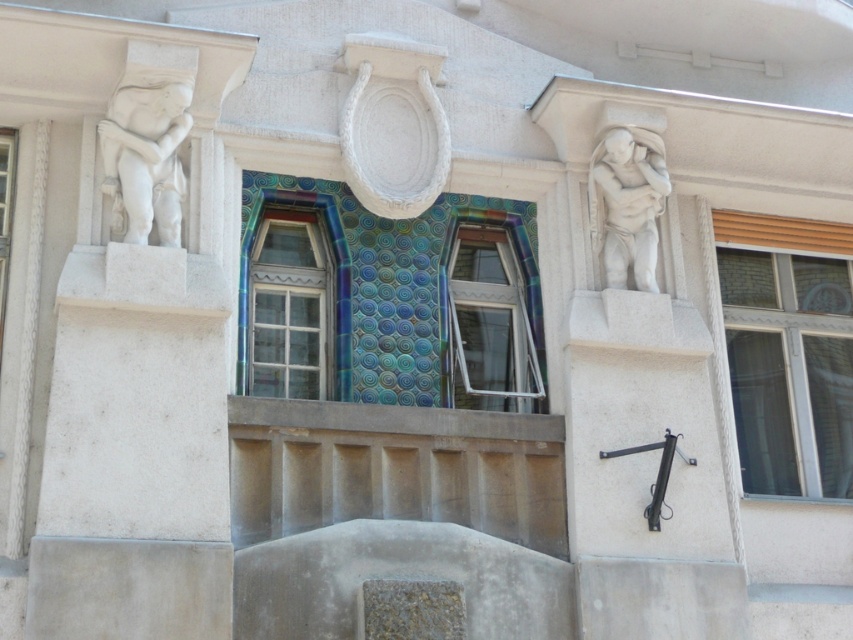
Question: Which point is farther to the camera?

Choices:
 (A) (12, 189)
 (B) (490, 323)
 (C) (753, 291)
 (D) (651, 220)

Answer: (C)

Question: Does white stone sculpture at right appear on the left side of multicolored mosaic tile at center?

Choices:
 (A) yes
 (B) no

Answer: (B)

Question: Which point is farther to the camera?

Choices:
 (A) (509, 288)
 (B) (653, 152)
 (C) (343, 253)

Answer: (A)

Question: Does white plastic window at center have a smaller size compared to clear glass window at left?

Choices:
 (A) no
 (B) yes

Answer: (A)

Question: Among these points, which one is nearest to the camera?

Choices:
 (A) (337, 220)
 (B) (647, 275)

Answer: (A)

Question: Is white stone sculpture at right thinner than clear glass window at left?

Choices:
 (A) yes
 (B) no

Answer: (B)